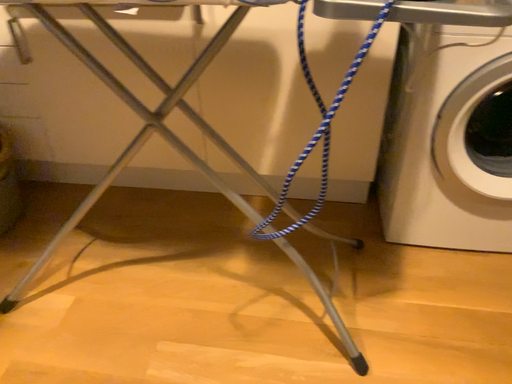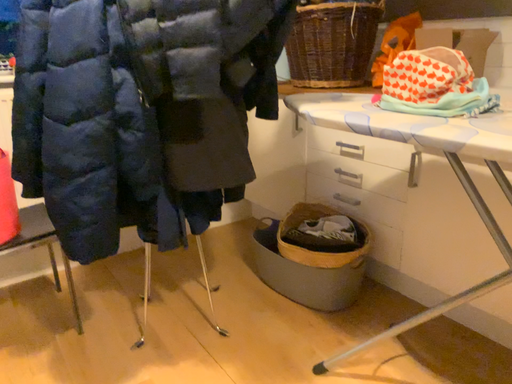
Question: How did the camera likely rotate when shooting the video?

Choices:
 (A) rotated left
 (B) rotated right

Answer: (A)